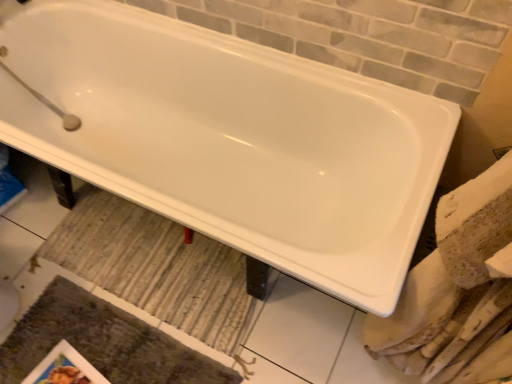
Image resolution: width=512 pixels, height=384 pixels. I want to click on textured gray bath mat at lower left, which is the 1th bath mat in bottom-to-top order, so click(x=103, y=342).

Where is `striped fabric bath mat at center, the 1th bath mat when ordered from top to bottom`? The width and height of the screenshot is (512, 384). striped fabric bath mat at center, the 1th bath mat when ordered from top to bottom is located at coordinates (155, 267).

Locate an element on the screen. The height and width of the screenshot is (384, 512). matte paper magazine at lower left is located at coordinates (64, 368).

Locate an element on the screen. textured gray bath mat at lower left, which is the 1th bath mat in bottom-to-top order is located at coordinates (103, 342).

From the image's perspective, is textured gray bath mat at lower left, placed as the 2th bath mat when sorted from top to bottom, located above or below matte paper magazine at lower left?

textured gray bath mat at lower left, placed as the 2th bath mat when sorted from top to bottom, is situated higher than matte paper magazine at lower left in the image.

Which of these two, textured gray bath mat at lower left, placed as the 2th bath mat when sorted from top to bottom, or matte paper magazine at lower left, is smaller?

matte paper magazine at lower left.

Which is in front, textured gray bath mat at lower left, which is the 1th bath mat in bottom-to-top order, or matte paper magazine at lower left?

Positioned in front is textured gray bath mat at lower left, which is the 1th bath mat in bottom-to-top order.

Is matte paper magazine at lower left next to striped fabric bath mat at center, the 1th bath mat when ordered from top to bottom, and touching it?

matte paper magazine at lower left is not next to striped fabric bath mat at center, the 1th bath mat when ordered from top to bottom, and they're not touching.

From a real-world perspective, which is physically below, matte paper magazine at lower left or striped fabric bath mat at center, the 1th bath mat when ordered from top to bottom?

From a 3D spatial view, matte paper magazine at lower left is below.

The image size is (512, 384). I want to click on bath mat behind the matte paper magazine at lower left, so click(x=155, y=267).

Considering the sizes of matte paper magazine at lower left and striped fabric bath mat at center, the 1th bath mat when ordered from top to bottom, in the image, is matte paper magazine at lower left wider or thinner than striped fabric bath mat at center, the 1th bath mat when ordered from top to bottom,?

matte paper magazine at lower left is thinner than striped fabric bath mat at center, the 1th bath mat when ordered from top to bottom.

Where is `bath mat on the left side of striped fabric bath mat at center, the second bath mat positioned from the bottom`? The width and height of the screenshot is (512, 384). bath mat on the left side of striped fabric bath mat at center, the second bath mat positioned from the bottom is located at coordinates (103, 342).

Could you tell me if textured gray bath mat at lower left, which is the 1th bath mat in bottom-to-top order, is facing striped fabric bath mat at center, the 1th bath mat when ordered from top to bottom?

No, textured gray bath mat at lower left, which is the 1th bath mat in bottom-to-top order, is not oriented towards striped fabric bath mat at center, the 1th bath mat when ordered from top to bottom.

Based on their sizes in the image, would you say textured gray bath mat at lower left, which is the 1th bath mat in bottom-to-top order, is bigger or smaller than striped fabric bath mat at center, the 1th bath mat when ordered from top to bottom?

textured gray bath mat at lower left, which is the 1th bath mat in bottom-to-top order, is bigger than striped fabric bath mat at center, the 1th bath mat when ordered from top to bottom.

Looking at this image, is textured gray bath mat at lower left, which is the 1th bath mat in bottom-to-top order, taller than striped fabric bath mat at center, the second bath mat positioned from the bottom?

Correct, textured gray bath mat at lower left, which is the 1th bath mat in bottom-to-top order, is much taller as striped fabric bath mat at center, the second bath mat positioned from the bottom.

What's the angular difference between striped fabric bath mat at center, the second bath mat positioned from the bottom, and matte paper magazine at lower left's facing directions?

80.7 degrees.

Consider the image. Considering the sizes of striped fabric bath mat at center, the second bath mat positioned from the bottom, and matte paper magazine at lower left in the image, is striped fabric bath mat at center, the second bath mat positioned from the bottom, taller or shorter than matte paper magazine at lower left?

In the image, striped fabric bath mat at center, the second bath mat positioned from the bottom, appears to be taller than matte paper magazine at lower left.

Does striped fabric bath mat at center, the second bath mat positioned from the bottom, come behind matte paper magazine at lower left?

Yes.

Image resolution: width=512 pixels, height=384 pixels. What are the coordinates of `bath mat that appears behind the matte paper magazine at lower left` in the screenshot? It's located at (155, 267).

How different are the orientations of matte paper magazine at lower left and textured gray bath mat at lower left, which is the 1th bath mat in bottom-to-top order, in degrees?

There is a 9.26-degree angle between the facing directions of matte paper magazine at lower left and textured gray bath mat at lower left, which is the 1th bath mat in bottom-to-top order.

Based on the photo, could you tell me if matte paper magazine at lower left is facing textured gray bath mat at lower left, placed as the 2th bath mat when sorted from top to bottom?

Yes, matte paper magazine at lower left faces towards textured gray bath mat at lower left, placed as the 2th bath mat when sorted from top to bottom.

Consider the image. Is matte paper magazine at lower left to the left or to the right of textured gray bath mat at lower left, which is the 1th bath mat in bottom-to-top order, in the image?

In the image, matte paper magazine at lower left appears on the left side of textured gray bath mat at lower left, which is the 1th bath mat in bottom-to-top order.

From a real-world perspective, does matte paper magazine at lower left sit lower than textured gray bath mat at lower left, placed as the 2th bath mat when sorted from top to bottom?

Yes, from a real-world perspective, matte paper magazine at lower left is below textured gray bath mat at lower left, placed as the 2th bath mat when sorted from top to bottom.

Is striped fabric bath mat at center, the second bath mat positioned from the bottom, directly adjacent to textured gray bath mat at lower left, placed as the 2th bath mat when sorted from top to bottom?

They are not placed beside each other.

Is striped fabric bath mat at center, the 1th bath mat when ordered from top to bottom, in front of or behind textured gray bath mat at lower left, which is the 1th bath mat in bottom-to-top order, in the image?

striped fabric bath mat at center, the 1th bath mat when ordered from top to bottom, is positioned farther from the viewer than textured gray bath mat at lower left, which is the 1th bath mat in bottom-to-top order.

Who is shorter, striped fabric bath mat at center, the second bath mat positioned from the bottom, or textured gray bath mat at lower left, which is the 1th bath mat in bottom-to-top order?

With less height is striped fabric bath mat at center, the second bath mat positioned from the bottom.

Is striped fabric bath mat at center, the second bath mat positioned from the bottom, located outside textured gray bath mat at lower left, which is the 1th bath mat in bottom-to-top order?

Indeed, striped fabric bath mat at center, the second bath mat positioned from the bottom, is completely outside textured gray bath mat at lower left, which is the 1th bath mat in bottom-to-top order.

From the image's perspective, which bath mat is the 1st one above the matte paper magazine at lower left? Please provide its 2D coordinates.

[(103, 342)]

Where is `the 2nd bath mat to the right of the matte paper magazine at lower left, counting from the anchor's position`? This screenshot has width=512, height=384. the 2nd bath mat to the right of the matte paper magazine at lower left, counting from the anchor's position is located at coordinates (155, 267).

Looking at the image, which one is located further to matte paper magazine at lower left, striped fabric bath mat at center, the second bath mat positioned from the bottom, or textured gray bath mat at lower left, placed as the 2th bath mat when sorted from top to bottom?

striped fabric bath mat at center, the second bath mat positioned from the bottom.

When comparing their distances from striped fabric bath mat at center, the second bath mat positioned from the bottom, does matte paper magazine at lower left or textured gray bath mat at lower left, placed as the 2th bath mat when sorted from top to bottom, seem further?

matte paper magazine at lower left is further to striped fabric bath mat at center, the second bath mat positioned from the bottom.

Based on their spatial positions, is textured gray bath mat at lower left, which is the 1th bath mat in bottom-to-top order, or striped fabric bath mat at center, the second bath mat positioned from the bottom, further from matte paper magazine at lower left?

Among the two, striped fabric bath mat at center, the second bath mat positioned from the bottom, is located further to matte paper magazine at lower left.

From the image, which object appears to be farther from textured gray bath mat at lower left, which is the 1th bath mat in bottom-to-top order, matte paper magazine at lower left or striped fabric bath mat at center, the 1th bath mat when ordered from top to bottom?

striped fabric bath mat at center, the 1th bath mat when ordered from top to bottom, lies further to textured gray bath mat at lower left, which is the 1th bath mat in bottom-to-top order, than the other object.

When comparing their distances from textured gray bath mat at lower left, which is the 1th bath mat in bottom-to-top order, does striped fabric bath mat at center, the 1th bath mat when ordered from top to bottom, or matte paper magazine at lower left seem closer?

matte paper magazine at lower left is closer to textured gray bath mat at lower left, which is the 1th bath mat in bottom-to-top order.

Based on their spatial positions, is textured gray bath mat at lower left, which is the 1th bath mat in bottom-to-top order, or matte paper magazine at lower left further from striped fabric bath mat at center, the second bath mat positioned from the bottom?

matte paper magazine at lower left lies further to striped fabric bath mat at center, the second bath mat positioned from the bottom, than the other object.

I want to click on bath mat between striped fabric bath mat at center, the second bath mat positioned from the bottom, and matte paper magazine at lower left in the up-down direction, so click(103, 342).